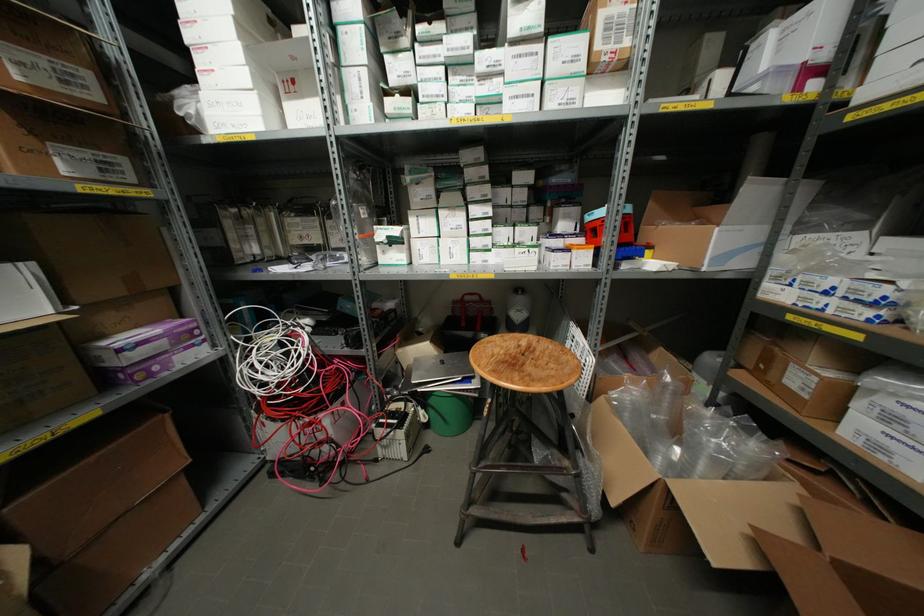
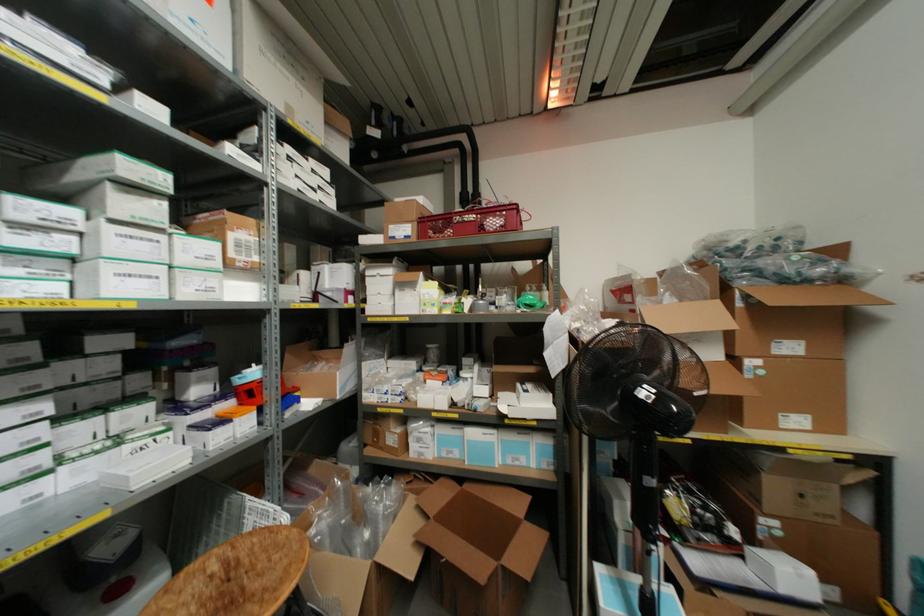
Question: How did the camera likely rotate?

Choices:
 (A) Left
 (B) Right
 (C) Up
 (D) Down

Answer: (B)